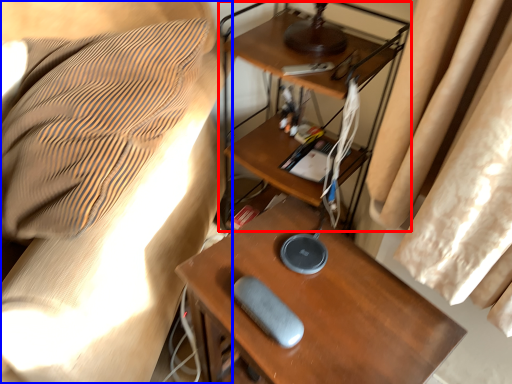
Question: Which object is further to the camera taking this photo, computer desk (highlighted by a red box) or furniture (highlighted by a blue box)?

Choices:
 (A) computer desk
 (B) furniture

Answer: (A)